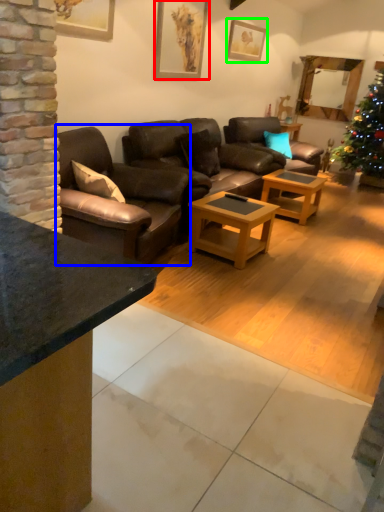
Question: Based on their relative distances, which object is farther from picture frame (highlighted by a red box)? Choose from studio couch (highlighted by a blue box) and picture frame (highlighted by a green box).

Choices:
 (A) studio couch
 (B) picture frame

Answer: (A)